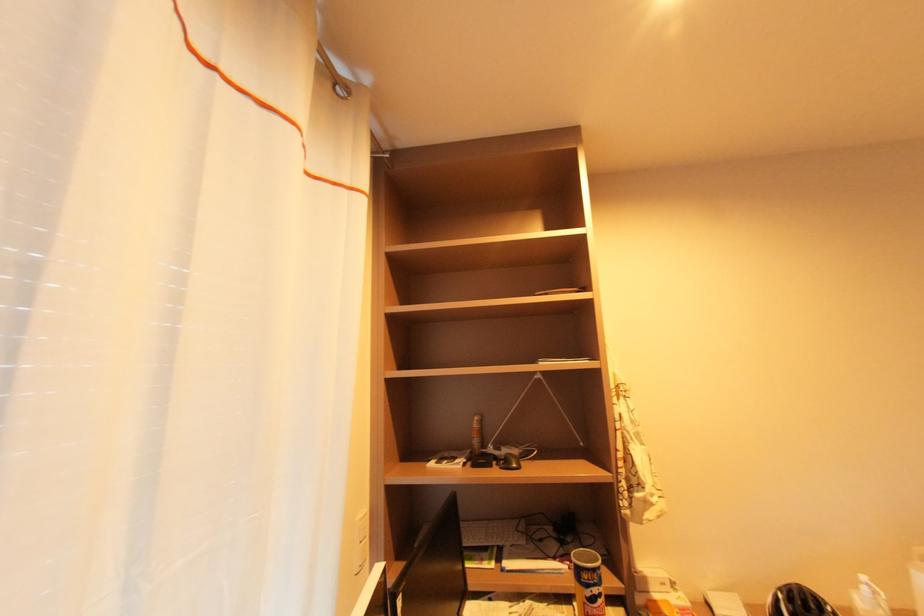
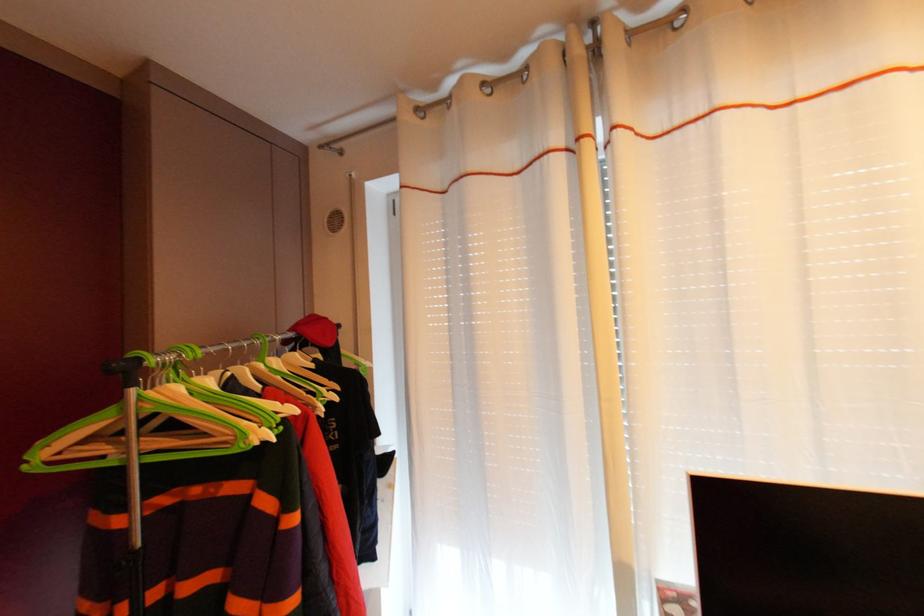
Question: The camera is either moving clockwise (left) or counter-clockwise (right) around the object. The first image is from the beginning of the video and the second image is from the end. Is the camera moving left or right when shooting the video?

Choices:
 (A) Left
 (B) Right

Answer: (B)